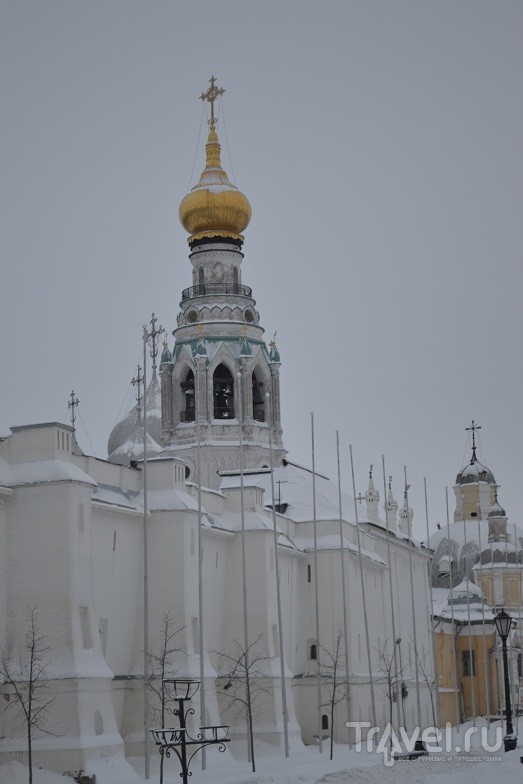
Locate an element on the screen. The width and height of the screenshot is (523, 784). windows is located at coordinates (324, 720), (466, 663), (312, 651), (308, 570).